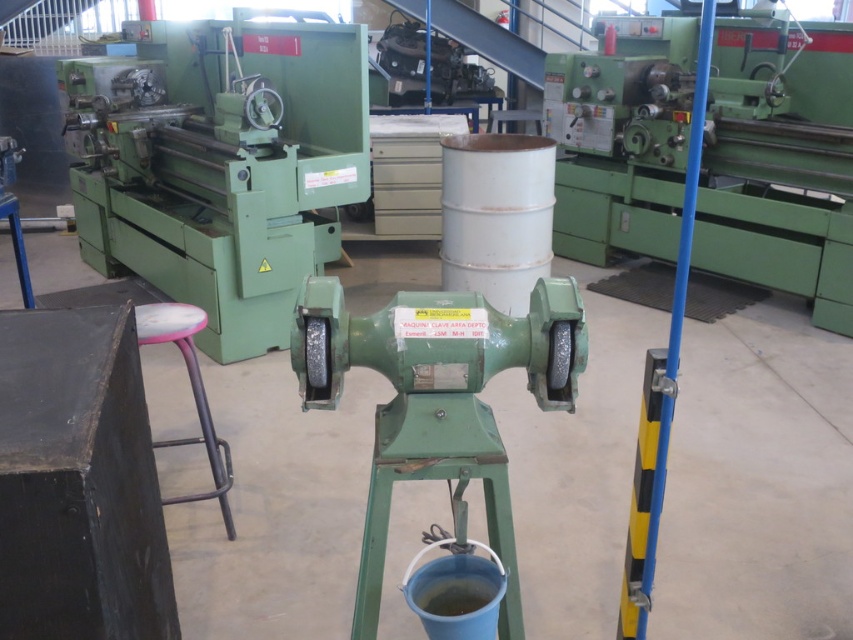
Between point (334, 355) and point (227, 458), which one is positioned behind?

The point (227, 458) is behind.

Can you confirm if green metallic grinding machine at center is positioned above pink plastic stool at lower left?

Incorrect, green metallic grinding machine at center is not positioned above pink plastic stool at lower left.

Which is behind, point (325, 300) or point (206, 317)?

Point (206, 317)

The image size is (853, 640). What are the coordinates of `green metallic grinding machine at center` in the screenshot? It's located at (437, 400).